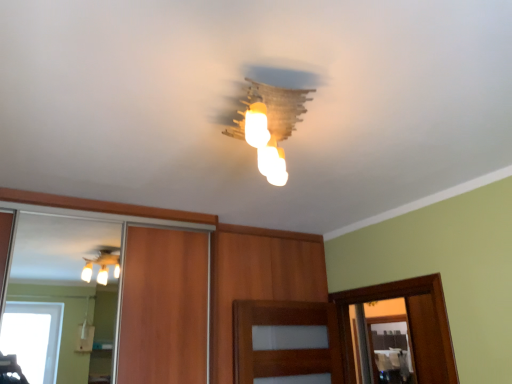
Question: Should I look upward or downward to see matte glass chandelier at center?

Choices:
 (A) up
 (B) down

Answer: (A)